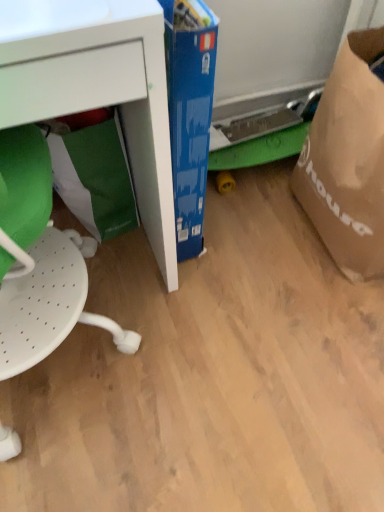
Locate an element on the screen. The width and height of the screenshot is (384, 512). spots to the right of white perforated swivel chair at left is located at coordinates (226, 342).